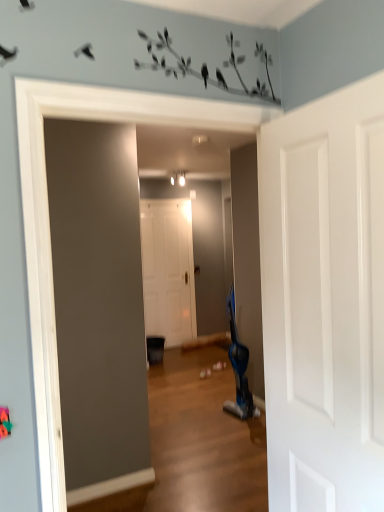
Question: Considering the positions of point (279, 461) and point (178, 261), is point (279, 461) closer or farther from the camera than point (178, 261)?

Choices:
 (A) closer
 (B) farther

Answer: (A)

Question: From the image's perspective, is white glossy door at upper right, the first door when ordered from front to back, located above or below white matte door at center, the second door from the right?

Choices:
 (A) below
 (B) above

Answer: (A)

Question: Which object is the closest to the white glossy door at upper right, the first door when ordered from front to back?

Choices:
 (A) blue plastic swivel chair at center-right
 (B) white matte door at center, which ranks as the 2th door in front-to-back order

Answer: (A)

Question: Which object is positioned closest to the white glossy door at upper right, the first door when ordered from front to back?

Choices:
 (A) blue plastic swivel chair at center-right
 (B) white matte door at center, the second door from the right

Answer: (A)